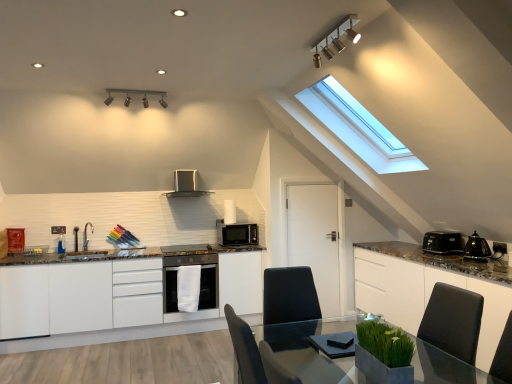
Question: Which direction should I rotate to look at matte black microwave at center, arranged as the first kitchen appliance when viewed from the right?

Choices:
 (A) left
 (B) right

Answer: (A)

Question: Is white glossy cabinet at right, which ranks as the second cabinetry in left-to-right order, behind black plastic toaster at right, the 1th appliance from the front?

Choices:
 (A) yes
 (B) no

Answer: (B)

Question: Is white glossy cabinet at right, which ranks as the second cabinetry in left-to-right order, not within black plastic toaster at right, the 2th appliance viewed from the back?

Choices:
 (A) no
 (B) yes

Answer: (B)

Question: Considering the relative sizes of white glossy cabinet at right, which ranks as the second cabinetry in left-to-right order, and black plastic toaster at right, the 2th appliance viewed from the back, in the image provided, is white glossy cabinet at right, which ranks as the second cabinetry in left-to-right order, thinner than black plastic toaster at right, the 2th appliance viewed from the back,?

Choices:
 (A) no
 (B) yes

Answer: (A)

Question: Is white glossy cabinet at right, the 1th cabinetry in the right-to-left sequence, to the left of black plastic toaster at right, the 2th appliance viewed from the back, from the viewer's perspective?

Choices:
 (A) no
 (B) yes

Answer: (B)

Question: Is white glossy cabinet at right, the 1th cabinetry in the right-to-left sequence, facing towards black plastic toaster at right, the 2th appliance viewed from the back?

Choices:
 (A) no
 (B) yes

Answer: (A)

Question: From the image's perspective, does white glossy cabinet at right, the 1th cabinetry in the right-to-left sequence, appear higher than black plastic toaster at right, the 2th appliance viewed from the back?

Choices:
 (A) yes
 (B) no

Answer: (B)

Question: Are white glossy cabinet at right, which ranks as the second cabinetry in left-to-right order, and clear glass table at center far apart?

Choices:
 (A) no
 (B) yes

Answer: (B)

Question: Considering the relative sizes of white glossy cabinet at right, the 1th cabinetry in the right-to-left sequence, and clear glass table at center in the image provided, is white glossy cabinet at right, the 1th cabinetry in the right-to-left sequence, thinner than clear glass table at center?

Choices:
 (A) no
 (B) yes

Answer: (B)

Question: Considering the relative sizes of white glossy cabinet at right, the 1th cabinetry in the right-to-left sequence, and clear glass table at center in the image provided, is white glossy cabinet at right, the 1th cabinetry in the right-to-left sequence, smaller than clear glass table at center?

Choices:
 (A) yes
 (B) no

Answer: (B)

Question: From a real-world perspective, is white glossy cabinet at right, the 1th cabinetry in the right-to-left sequence, located beneath clear glass table at center?

Choices:
 (A) yes
 (B) no

Answer: (A)

Question: From the image's perspective, is white glossy cabinet at right, the 1th cabinetry in the right-to-left sequence, over clear glass table at center?

Choices:
 (A) yes
 (B) no

Answer: (B)

Question: Is white glossy cabinet at right, which ranks as the second cabinetry in left-to-right order, aimed at clear glass table at center?

Choices:
 (A) yes
 (B) no

Answer: (A)

Question: Is satin silver range hood at upper center, which is the 1th kitchen appliance from left to right, inside white glossy cabinets at center, acting as the 1th cabinetry starting from the left?

Choices:
 (A) no
 (B) yes

Answer: (A)